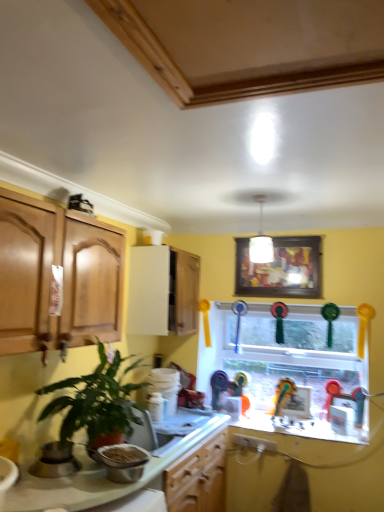
Question: In terms of size, does wooden framed picture at upper center appear bigger or smaller than glass window at center?

Choices:
 (A) big
 (B) small

Answer: (B)

Question: Is wooden framed picture at upper center to the left or to the right of glass window at center in the image?

Choices:
 (A) right
 (B) left

Answer: (B)

Question: Based on their relative distances, which object is nearer to the metallic silver bowl at lower left, which is counted as the 2th appliance, starting from the left?

Choices:
 (A) white glossy countertop at lower center
 (B) green glossy plant at lower left
 (C) satin silver pot at lower left, the first appliance positioned from the left
 (D) glass window at center
 (E) white glossy cabinet at upper center

Answer: (A)

Question: Which of these objects is positioned closest to the wooden framed picture at upper center?

Choices:
 (A) white glossy cabinet at upper center
 (B) green glossy plant at lower left
 (C) glass window at center
 (D) satin silver pot at lower left, which is the second appliance in right-to-left order
 (E) white glossy countertop at lower center

Answer: (A)